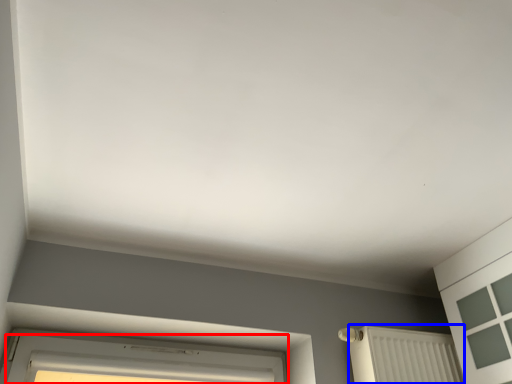
Question: Which object appears farthest to the camera in this image, window (highlighted by a red box) or radiator (highlighted by a blue box)?

Choices:
 (A) window
 (B) radiator

Answer: (B)